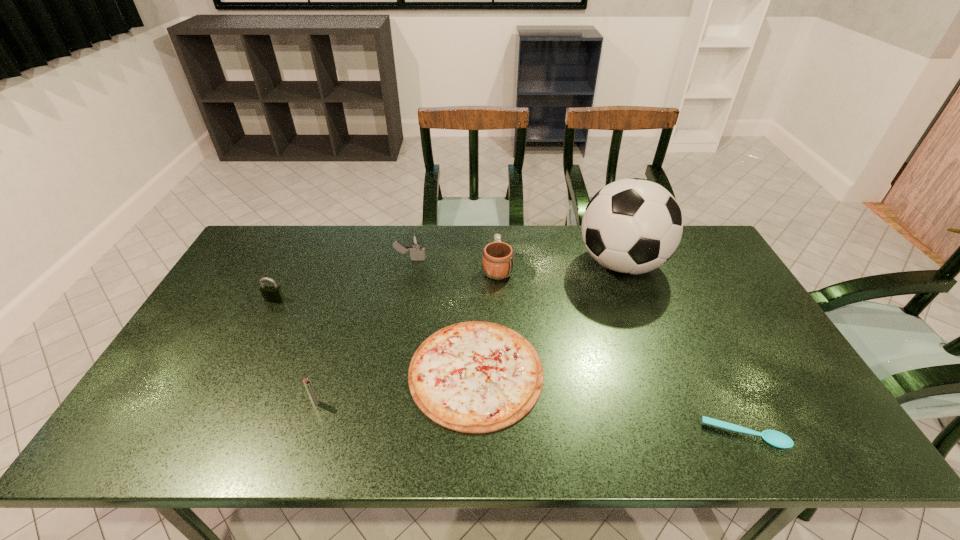
The image size is (960, 540). I want to click on vacant point located between the soccer ball and the mug, so click(x=559, y=266).

In order to click on object that is the fourth nearest to the mug in this screenshot , I will do `click(307, 383)`.

I want to click on object identified as the second closest to the shortest object, so click(x=632, y=226).

Identify the location of vacant area that satisfies the following two spatial constraints: 1. on the back side of the padlock; 2. on the left side of the right igniter. (296, 259).

Find the location of a particular element. The width and height of the screenshot is (960, 540). free location that satisfies the following two spatial constraints: 1. on the back side of the taller igniter; 2. on the right side of the fourth farthest object is located at coordinates (296, 259).

The image size is (960, 540). What are the coordinates of `free point that satisfies the following two spatial constraints: 1. on the back side of the nearer igniter; 2. on the left side of the pizza` in the screenshot? It's located at (324, 372).